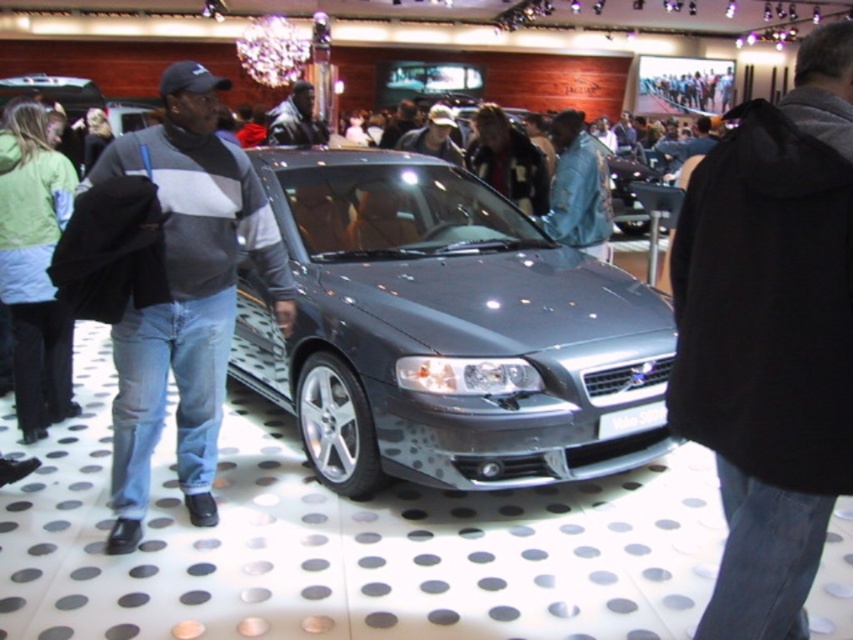
Question: Is black fabric jacket at center further to the viewer compared to leather jacket at center?

Choices:
 (A) no
 (B) yes

Answer: (A)

Question: Which object is positioned farthest from the satin metallic car at center?

Choices:
 (A) black fabric jacket at center
 (B) gray sweater at center

Answer: (A)

Question: Which point is closer to the camera?

Choices:
 (A) [554, 179]
 (B) [637, 416]

Answer: (B)

Question: Observing the image, what is the correct spatial positioning of satin metallic car at center in reference to gray sweater at center?

Choices:
 (A) left
 (B) right

Answer: (B)

Question: Among these objects, which one is nearest to the camera?

Choices:
 (A) gray sweater at center
 (B) satin metallic car at center
 (C) black fabric jacket at center

Answer: (C)

Question: Does black fabric jacket at center appear on the left side of gray sweater at center?

Choices:
 (A) no
 (B) yes

Answer: (A)